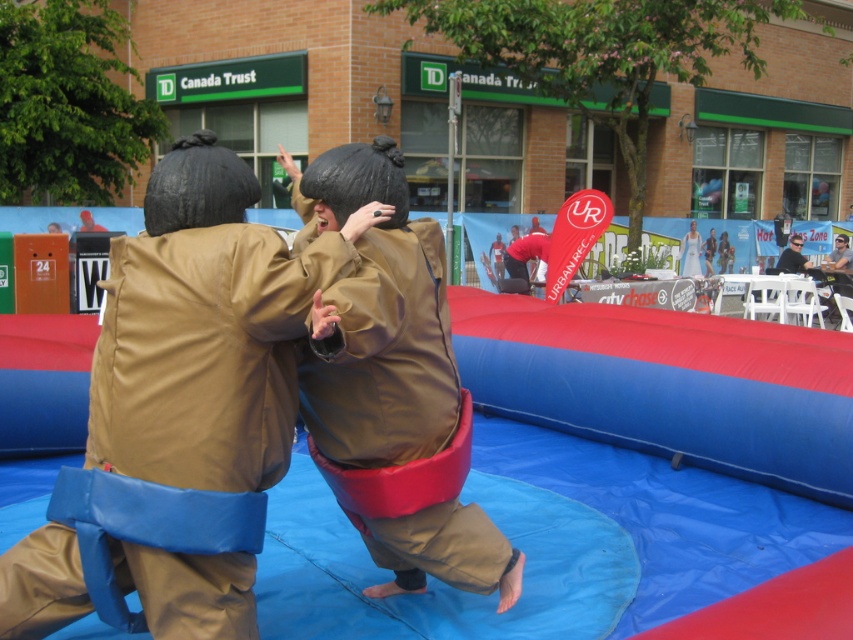
Question: Which point is closer to the camera taking this photo?

Choices:
 (A) (375, 209)
 (B) (386, 556)
 (C) (788, 266)

Answer: (A)

Question: Does brown leather sumo at center have a smaller size compared to smooth black sunglasses at upper right?

Choices:
 (A) yes
 (B) no

Answer: (B)

Question: Does brown leather sumo at center have a smaller size compared to brown matte sumo at center?

Choices:
 (A) yes
 (B) no

Answer: (A)

Question: Which point is closer to the camera taking this photo?

Choices:
 (A) (160, 323)
 (B) (345, 164)
 (C) (793, 260)

Answer: (A)

Question: Is brown leather sumo at center wider than smooth black sunglasses at upper right?

Choices:
 (A) no
 (B) yes

Answer: (B)

Question: Estimate the real-world distances between objects in this image. Which object is farther from the smooth black sunglasses at upper right?

Choices:
 (A) brown leather sumo at center
 (B) brown matte sumo at center

Answer: (A)